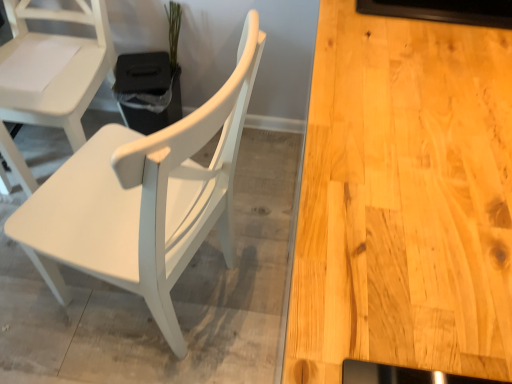
Question: Can you confirm if white matte wood chair at left, which is the second chair in left-to-right order, is shorter than white matte chair at left, acting as the second chair starting from the right?

Choices:
 (A) no
 (B) yes

Answer: (A)

Question: From a real-world perspective, is white matte wood chair at left, positioned as the first chair in right-to-left order, under white matte chair at left, the 1th chair in the left-to-right sequence?

Choices:
 (A) no
 (B) yes

Answer: (A)

Question: From a real-world perspective, does white matte wood chair at left, which is the second chair in left-to-right order, stand above white matte chair at left, acting as the second chair starting from the right?

Choices:
 (A) no
 (B) yes

Answer: (B)

Question: Are white matte wood chair at left, positioned as the first chair in right-to-left order, and white matte chair at left, acting as the second chair starting from the right, far apart?

Choices:
 (A) yes
 (B) no

Answer: (B)

Question: From the image's perspective, does white matte wood chair at left, which is the second chair in left-to-right order, appear lower than white matte chair at left, the 1th chair in the left-to-right sequence?

Choices:
 (A) no
 (B) yes

Answer: (B)

Question: From the image's perspective, is white matte wood chair at left, positioned as the first chair in right-to-left order, located above or below white matte chair at left, the 1th chair in the left-to-right sequence?

Choices:
 (A) above
 (B) below

Answer: (B)

Question: Is white matte wood chair at left, positioned as the first chair in right-to-left order, wider or thinner than white matte chair at left, acting as the second chair starting from the right?

Choices:
 (A) thin
 (B) wide

Answer: (B)

Question: Which is correct: white matte wood chair at left, positioned as the first chair in right-to-left order, is inside white matte chair at left, acting as the second chair starting from the right, or outside of it?

Choices:
 (A) outside
 (B) inside

Answer: (A)

Question: From a real-world perspective, is white matte wood chair at left, positioned as the first chair in right-to-left order, above or below white matte chair at left, acting as the second chair starting from the right?

Choices:
 (A) below
 (B) above

Answer: (B)

Question: From a real-world perspective, is green matte plant at upper center physically located above or below white matte wood chair at left, which is the second chair in left-to-right order?

Choices:
 (A) above
 (B) below

Answer: (B)

Question: Visually, is green matte plant at upper center positioned to the left or to the right of white matte wood chair at left, which is the second chair in left-to-right order?

Choices:
 (A) left
 (B) right

Answer: (A)

Question: Is green matte plant at upper center situated inside white matte wood chair at left, positioned as the first chair in right-to-left order, or outside?

Choices:
 (A) outside
 (B) inside

Answer: (A)

Question: From the image's perspective, is green matte plant at upper center positioned above or below white matte wood chair at left, positioned as the first chair in right-to-left order?

Choices:
 (A) below
 (B) above

Answer: (B)

Question: Based on their positions, is white matte chair at left, the 1th chair in the left-to-right sequence, located to the left or right of green matte plant at upper center?

Choices:
 (A) right
 (B) left

Answer: (B)

Question: In the image, is white matte chair at left, acting as the second chair starting from the right, positioned in front of or behind green matte plant at upper center?

Choices:
 (A) behind
 (B) front

Answer: (B)